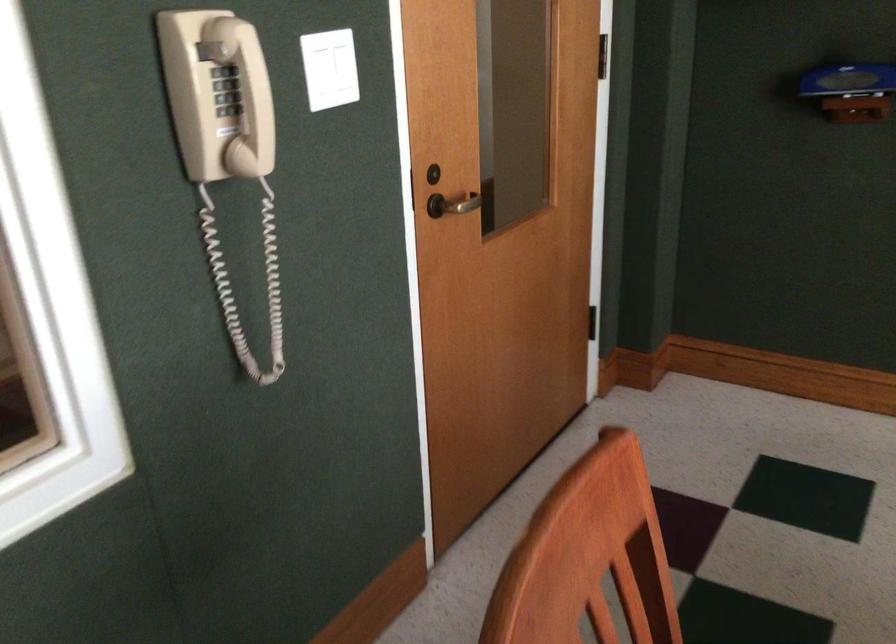
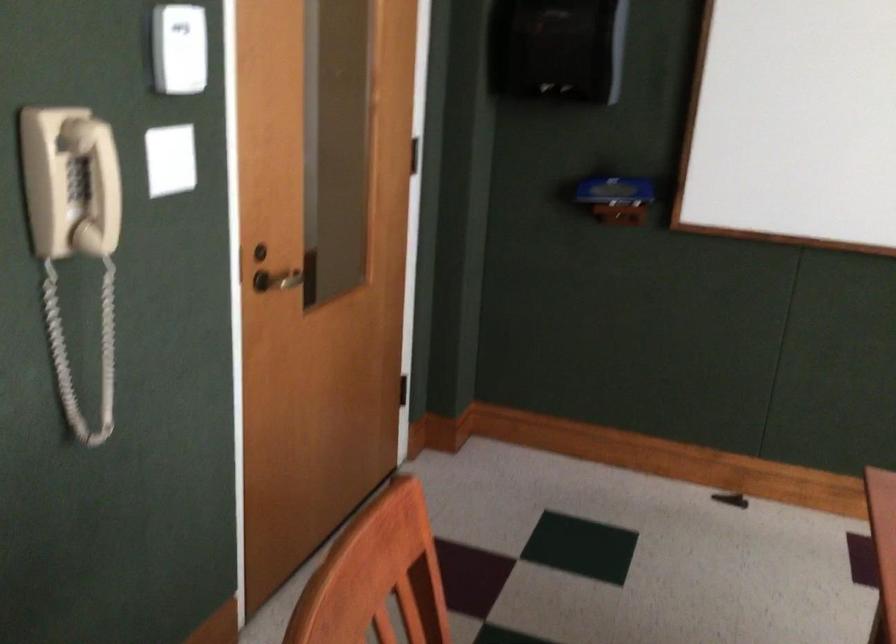
Question: Which direction would the cameraman need to move to produce the second image? Reply with the corresponding letter.

Choices:
 (A) Left
 (B) Right
 (C) Forward
 (D) Backward

Answer: (D)